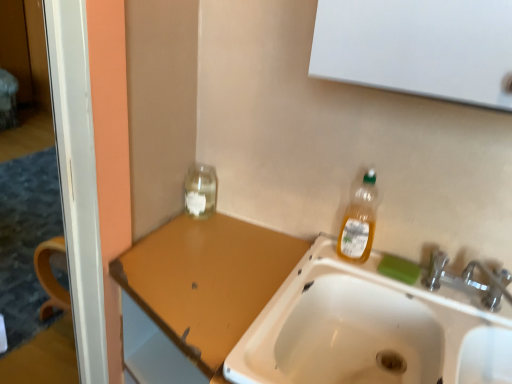
Where is `vacant region to the left of translucent plastic bottle at upper right`? This screenshot has height=384, width=512. vacant region to the left of translucent plastic bottle at upper right is located at coordinates (316, 264).